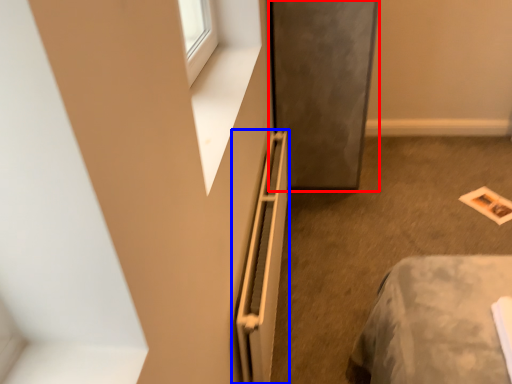
Question: Which object is further to the camera taking this photo, screen door (highlighted by a red box) or radiator (highlighted by a blue box)?

Choices:
 (A) screen door
 (B) radiator

Answer: (A)